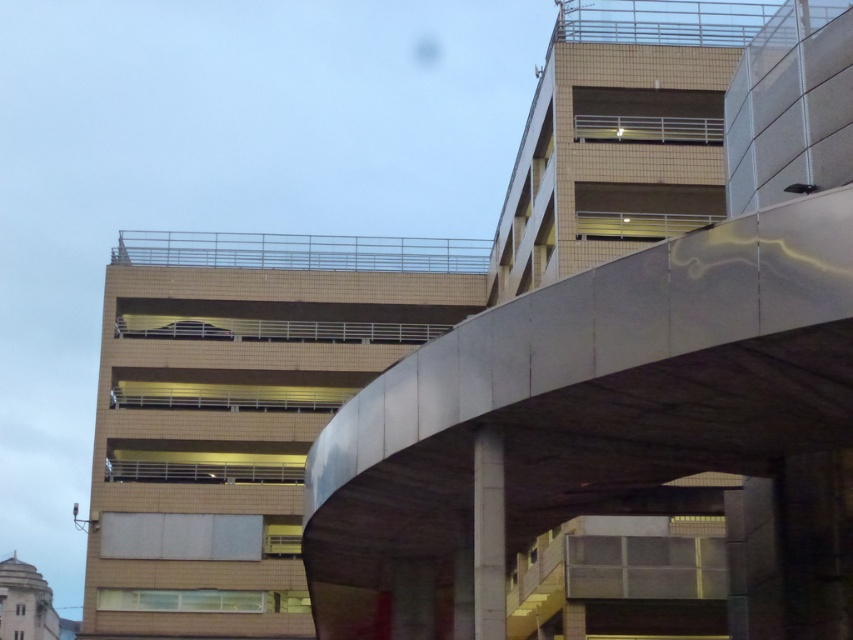
Question: Which object appears farthest from the camera in this image?

Choices:
 (A) gray concrete pillar at center
 (B) beige tile parking garage at center

Answer: (B)

Question: Considering the real-world distances, which object is farthest from the beige tile parking garage at center?

Choices:
 (A) gray concrete pillar at center
 (B) satin silver overpass at center

Answer: (A)

Question: Is beige tile parking garage at center below gray concrete pillar at center?

Choices:
 (A) no
 (B) yes

Answer: (A)

Question: Is satin silver overpass at center smaller than gray concrete pillar at center?

Choices:
 (A) no
 (B) yes

Answer: (A)

Question: Is beige tile parking garage at center above gray concrete pillar at center?

Choices:
 (A) yes
 (B) no

Answer: (A)

Question: Which object appears closest to the camera in this image?

Choices:
 (A) gray concrete pillar at center
 (B) satin silver overpass at center
 (C) beige tile parking garage at center

Answer: (B)